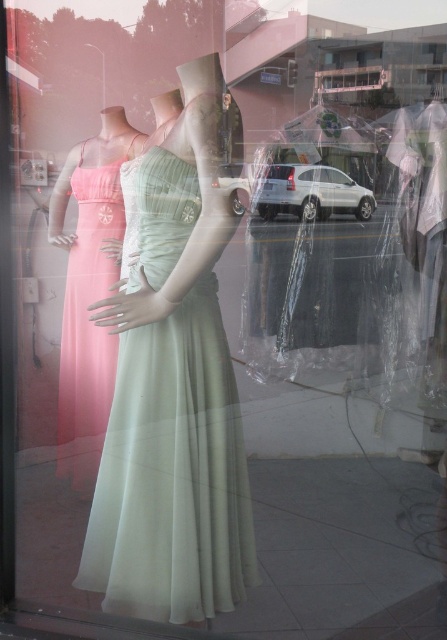
Question: Is satin pale green dress at center wider than matte pink fabric dress at left?

Choices:
 (A) yes
 (B) no

Answer: (A)

Question: Is satin pale green dress at center above matte pink fabric dress at left?

Choices:
 (A) yes
 (B) no

Answer: (B)

Question: Which point is farther to the camera?

Choices:
 (A) matte pink fabric dress at left
 (B) satin pale green dress at center

Answer: (A)

Question: Observing the image, what is the correct spatial positioning of satin pale green dress at center in reference to matte pink fabric dress at left?

Choices:
 (A) above
 (B) below

Answer: (B)

Question: Which of the following is the closest to the observer?

Choices:
 (A) coord(81,342)
 (B) coord(241,589)

Answer: (B)

Question: Which object is farther from the camera taking this photo?

Choices:
 (A) matte pink fabric dress at left
 (B) satin pale green dress at center

Answer: (A)